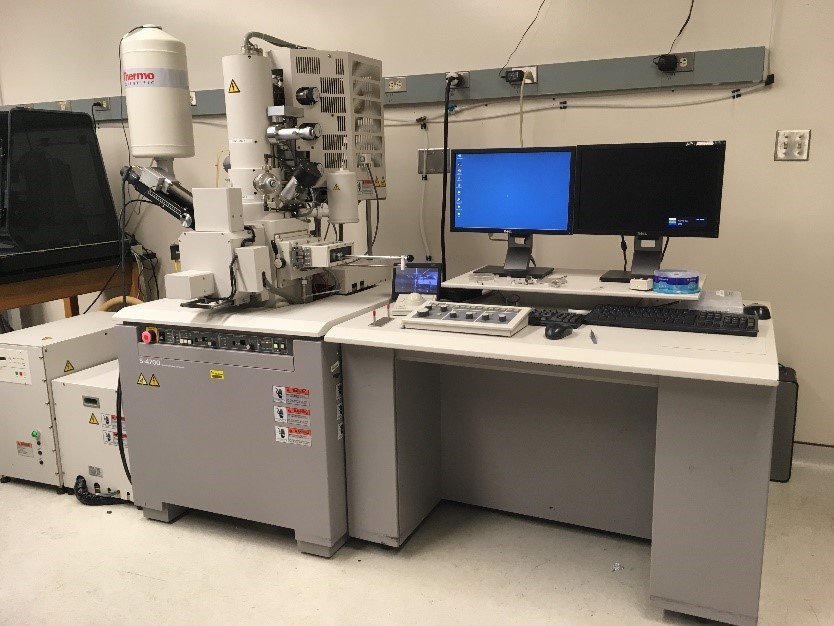
The image size is (834, 626). I want to click on gray desk, so coord(379,375).